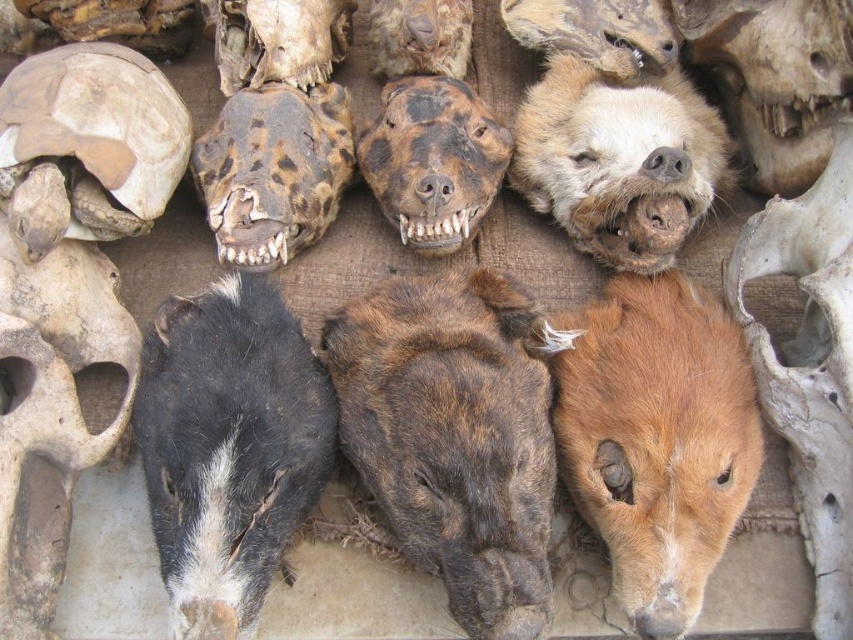
Who is shorter, brown fur at center or bone-like skull at lower left?

brown fur at center

Is point (524, 566) positioned behind point (61, 333)?

No, (524, 566) is in front of (61, 333).

I want to click on brown fur at center, so click(x=453, y=436).

Looking at this image, can you confirm if black fur animal at lower left is smaller than brown textured skull at center?

No.

Is black fur animal at lower left thinner than brown textured skull at center?

In fact, black fur animal at lower left might be wider than brown textured skull at center.

Is point (231, 508) positioned before point (422, 58)?

Yes, it is in front of point (422, 58).

Where is `black fur animal at lower left`? black fur animal at lower left is located at coordinates (229, 449).

Who is taller, bone-like skull at lower left or brown textured tortoise shell at upper left?

bone-like skull at lower left

Does bone-like skull at lower left appear over brown textured tortoise shell at upper left?

No.

Is point (82, 317) behind point (67, 141)?

No, it is not.

Identify the location of bone-like skull at lower left. (51, 412).